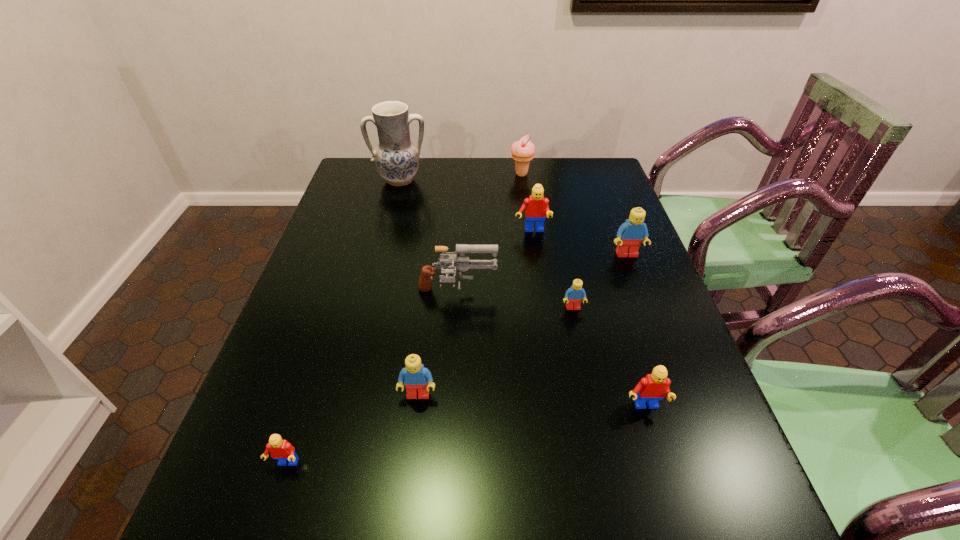
Identify the location of vacant point located 0.350m at the barrel end of the gun. The height and width of the screenshot is (540, 960). (635, 293).

You are a GUI agent. You are given a task and a screenshot of the screen. Output one action in this format:
    pyautogui.click(x=<x>, y=<y>)
    Task: Click on the vacant space situated on the face of the nearest blue Lego
    The height and width of the screenshot is (540, 960).
    Given the screenshot: What is the action you would take?
    pyautogui.click(x=410, y=461)

You are a GUI agent. You are given a task and a screenshot of the screen. Output one action in this format:
    pyautogui.click(x=<x>, y=<y>)
    Task: Click on the vacant point located on the front-facing side of the second biggest red Lego
    The image size is (960, 540).
    Given the screenshot: What is the action you would take?
    pyautogui.click(x=667, y=484)

Where is `free region located 0.100m on the face of the second blue Lego from right to left`? This screenshot has height=540, width=960. free region located 0.100m on the face of the second blue Lego from right to left is located at coordinates (581, 345).

Locate an element on the screen. free space located on the front-facing side of the nearest Lego is located at coordinates click(x=270, y=515).

This screenshot has width=960, height=540. Find the location of `pottery located at the far edge`. pottery located at the far edge is located at coordinates (396, 158).

You are a GUI agent. You are given a task and a screenshot of the screen. Output one action in this format:
    pyautogui.click(x=<x>, y=<y>)
    Task: Click on the icecream at the far edge
    The width and height of the screenshot is (960, 540).
    Given the screenshot: What is the action you would take?
    pyautogui.click(x=523, y=151)

Where is `pottery located at the left edge`? The height and width of the screenshot is (540, 960). pottery located at the left edge is located at coordinates pos(396,158).

This screenshot has height=540, width=960. Identify the location of Lego that is at the left edge. (280, 449).

At what (x,y) coordinates should I click in order to perform the action: click on object located at the far left corner. Please return your answer as a coordinate pair (x, y). Looking at the image, I should click on (396, 158).